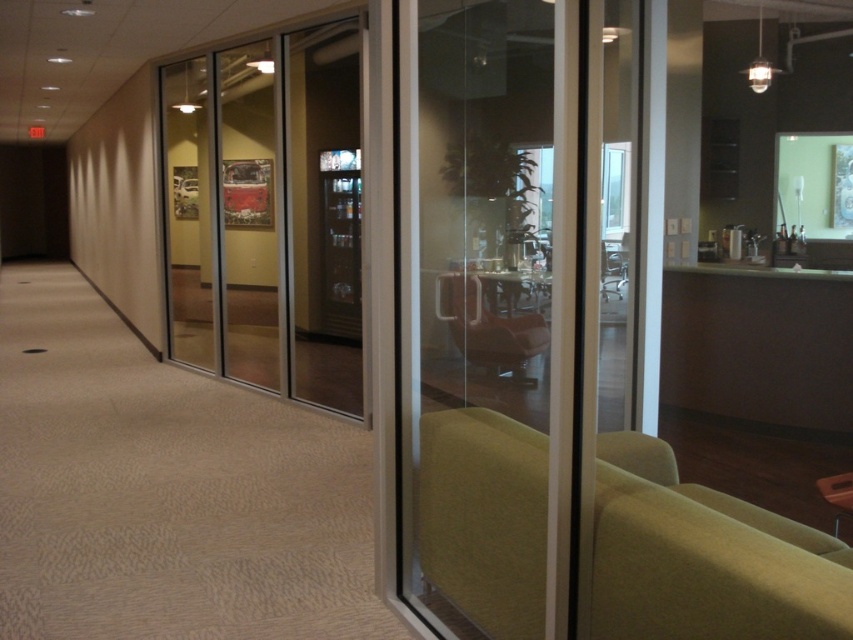
Does transparent glass door at center have a lesser width compared to matte green armchair at center?

Yes.

Is transparent glass door at center to the left of matte green armchair at center from the viewer's perspective?

Indeed, transparent glass door at center is positioned on the left side of matte green armchair at center.

Locate an element on the screen. The height and width of the screenshot is (640, 853). transparent glass door at center is located at coordinates (506, 305).

Identify the location of transparent glass door at center. The image size is (853, 640). (506, 305).

Describe the element at coordinates (704, 560) in the screenshot. I see `green fabric armchair at lower right` at that location.

Which is in front, point (665, 614) or point (466, 326)?

Point (665, 614) is more forward.

Locate an element on the screen. Image resolution: width=853 pixels, height=640 pixels. green fabric armchair at lower right is located at coordinates (x=704, y=560).

Locate an element on the screen. This screenshot has width=853, height=640. green fabric armchair at lower right is located at coordinates (704, 560).

Between point (273, 368) and point (450, 291), which one is positioned behind?

The point (273, 368) is more distant.

Image resolution: width=853 pixels, height=640 pixels. I want to click on clear glass door at center, so click(x=268, y=212).